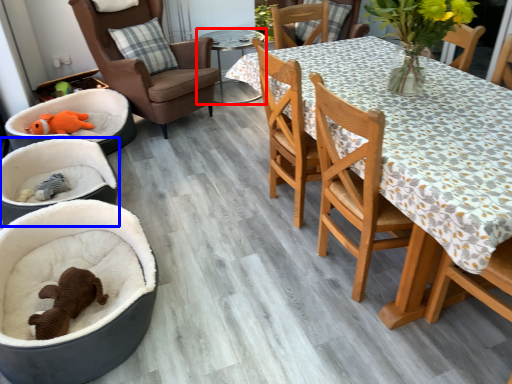
Question: Among these objects, which one is farthest to the camera, table (highlighted by a red box) or baby carriage (highlighted by a blue box)?

Choices:
 (A) table
 (B) baby carriage

Answer: (A)